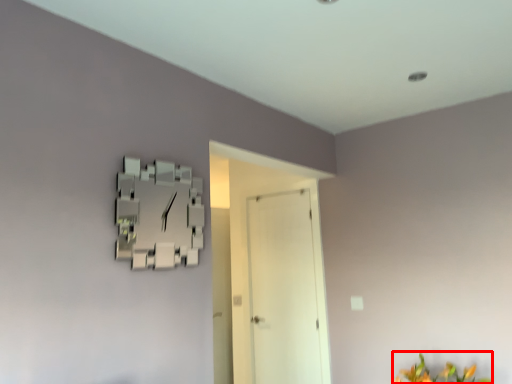
Question: From the image, what is the correct spatial relationship of flower (annotated by the red box) in relation to door?

Choices:
 (A) right
 (B) left

Answer: (A)